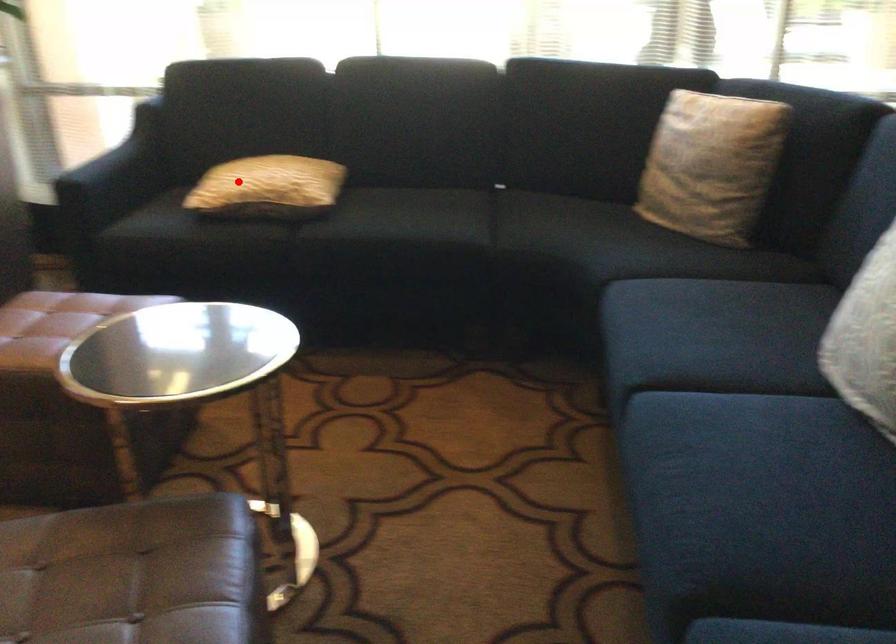
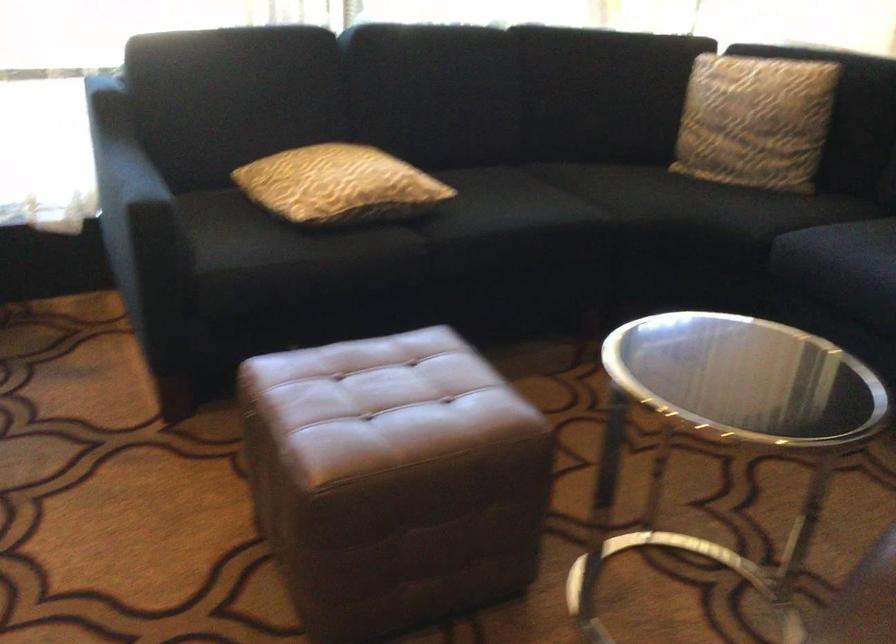
Question: A red point is marked in image1. In image2, is the corresponding 3D point closer to the camera or farther? Reply with the corresponding letter.

Choices:
 (A) The corresponding 3D point is closer.
 (B) The corresponding 3D point is farther.

Answer: (A)